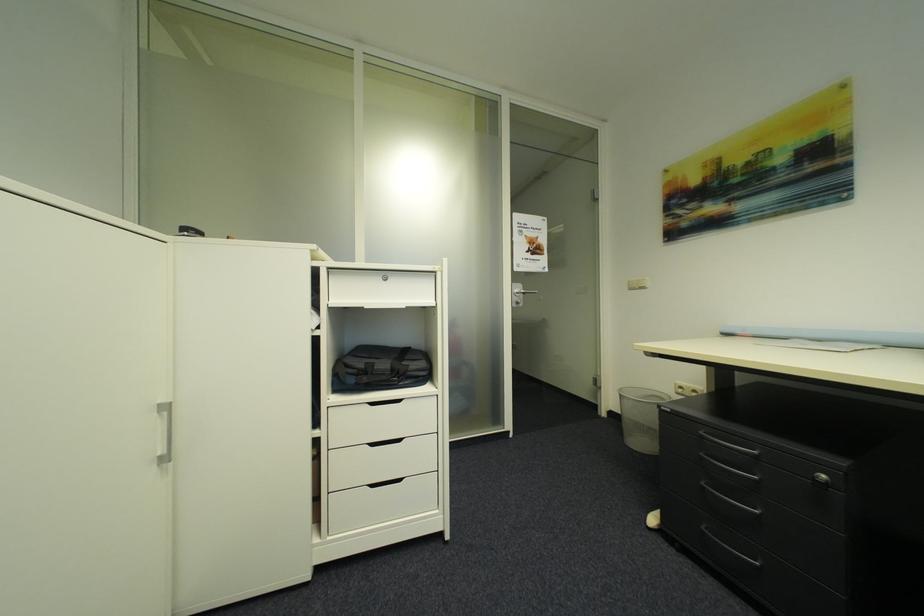
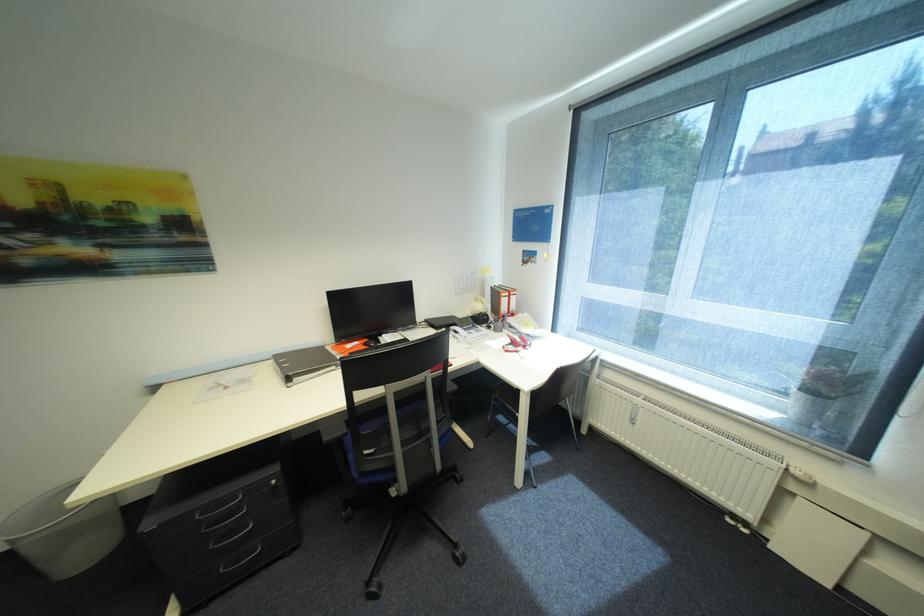
Find the pixel in the second image that matches (711,527) in the first image.

(229, 570)